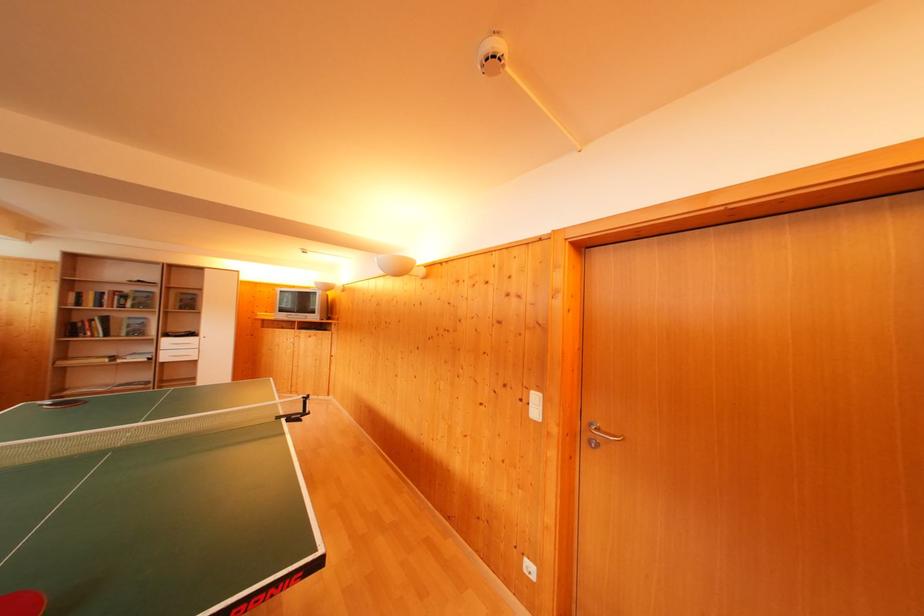
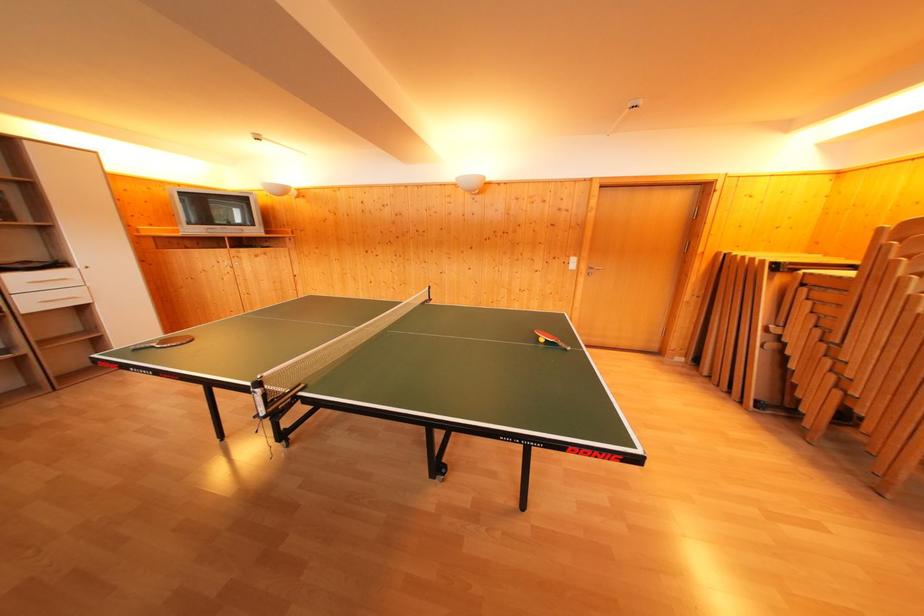
Find the pixel in the second image that matches point (198, 339) in the first image.

(64, 270)